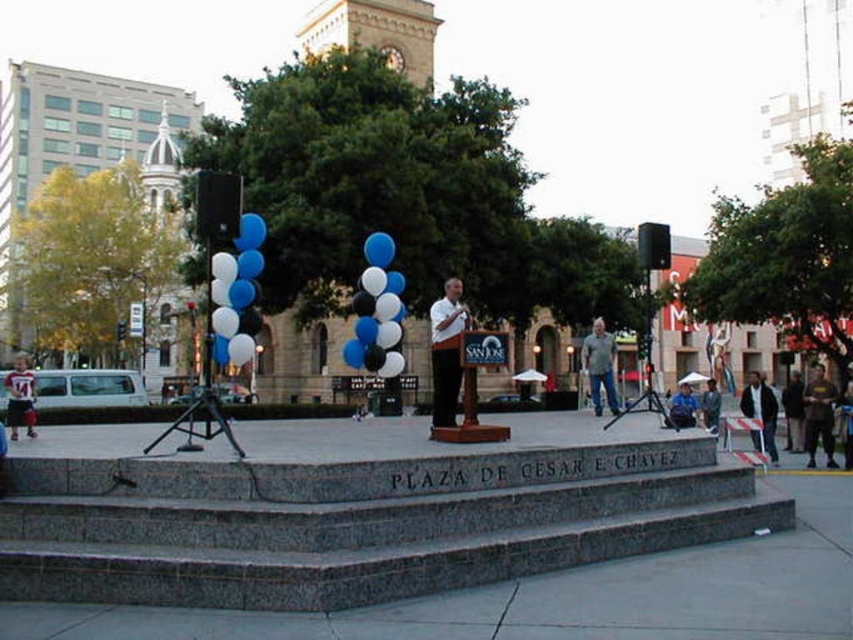
You are attending an event at Plaza de Cesar E Chavez and notice the blue glossy balloons at left and the white matte shirt at center. From your vantage point, which object appears higher in the scene?

The blue glossy balloons at left are located above the white matte shirt at center, so they appear higher in the scene.

You are a photographer positioned at the front of the stage and want to take a photo that includes both the dark gray hoodie at lower right and the striped jersey at lower left. Which one will appear closer to the camera in the photo?

The dark gray hoodie at lower right will appear closer to the camera in the photo because it is further to the viewer than the striped jersey at lower left.

In the scene shown: You are a photographer positioned at the center of the stage. You want to take a photo that includes both the dark gray hoodie at lower right and the striped jersey at lower left. Which direction should you turn to ensure both are visible in your frame?

You should turn to the right to include both the dark gray hoodie at lower right and the striped jersey at lower left in your frame, since the dark gray hoodie at lower right is to the right of the striped jersey at lower left.